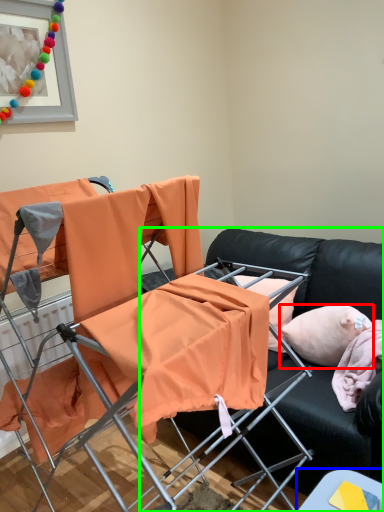
Question: Which object is positioned closest to pillow (highlighted by a red box)? Select from table (highlighted by a blue box) and studio couch (highlighted by a green box).

Choices:
 (A) table
 (B) studio couch

Answer: (B)